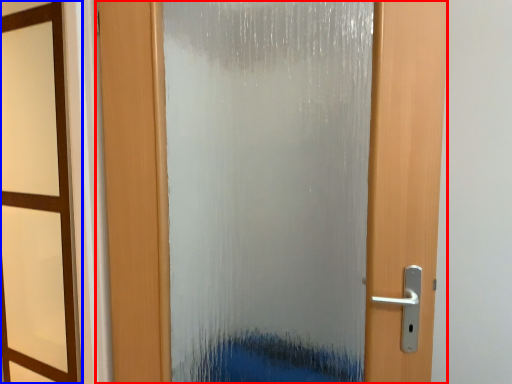
Question: Which point is closer to the camera, door (highlighted by a red box) or window frame (highlighted by a blue box)?

Choices:
 (A) door
 (B) window frame

Answer: (B)